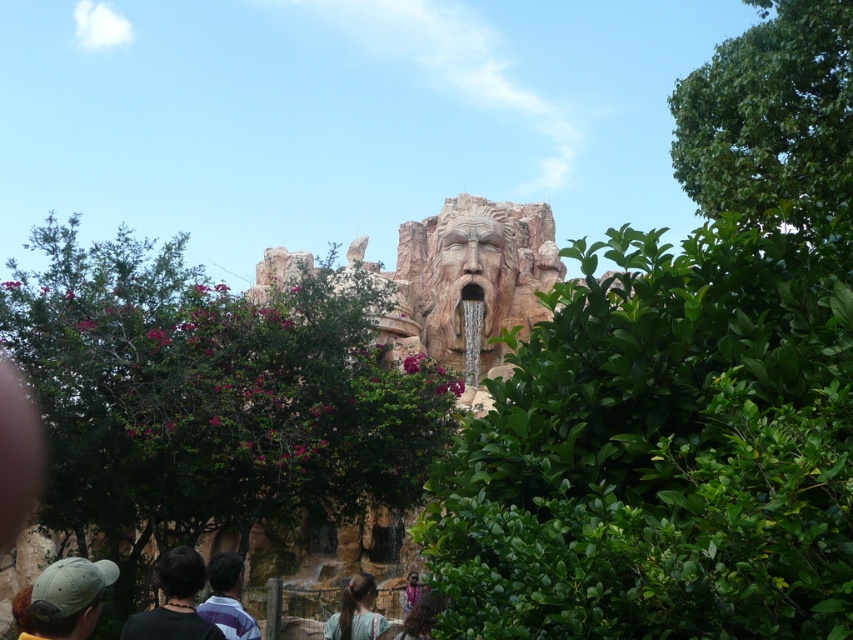
Is khaki fabric cap at lower left to the left of black fabric at lower left from the viewer's perspective?

Yes, khaki fabric cap at lower left is to the left of black fabric at lower left.

Identify the location of khaki fabric cap at lower left. This screenshot has height=640, width=853. (68, 596).

Is green leafy bush at center bigger than brown stone face at center?

Indeed, green leafy bush at center has a larger size compared to brown stone face at center.

Does green leafy bush at center come in front of brown stone face at center?

Yes, green leafy bush at center is in front of brown stone face at center.

This screenshot has height=640, width=853. What are the coordinates of `green leafy bush at center` in the screenshot? It's located at (662, 451).

Find the location of `green leafy bush at center`. green leafy bush at center is located at coordinates (662, 451).

Is green leafy tree at center above ponytail hair at lower center?

Correct, green leafy tree at center is located above ponytail hair at lower center.

In the scene shown: Between green leafy tree at center and ponytail hair at lower center, which one is positioned lower?

ponytail hair at lower center is below.

Is point (85, 554) closer to camera compared to point (334, 637)?

No, (85, 554) is behind (334, 637).

The image size is (853, 640). What are the coordinates of `green leafy tree at center` in the screenshot? It's located at (209, 397).